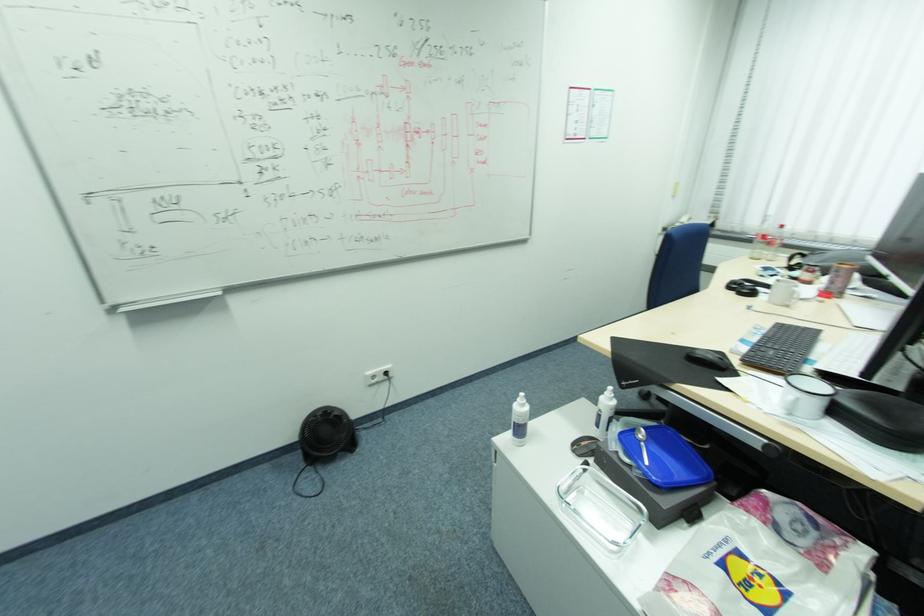
Where would you lift the glass food container? Please return your answer as a coordinate pair (x, y).

(601, 508)